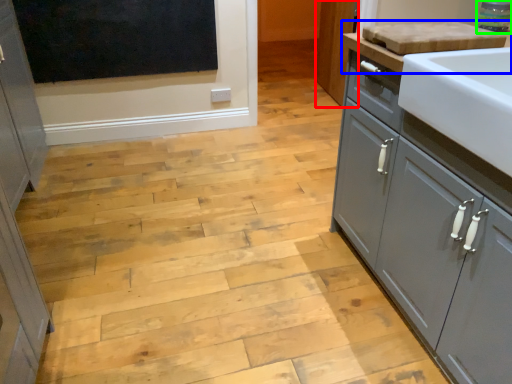
Question: Which is farther away from cabinetry (highlighted by a red box)? countertop (highlighted by a blue box) or appliance (highlighted by a green box)?

Choices:
 (A) countertop
 (B) appliance

Answer: (A)